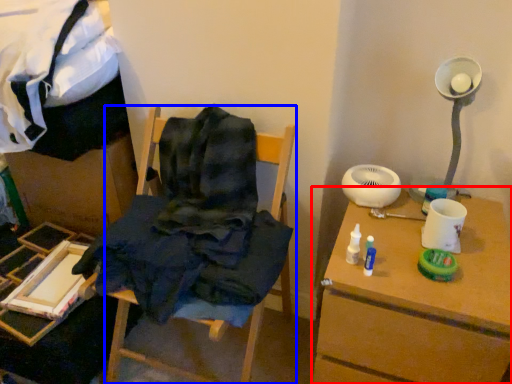
Question: Which object appears farthest to the camera in this image, table (highlighted by a red box) or furniture (highlighted by a blue box)?

Choices:
 (A) table
 (B) furniture

Answer: (A)